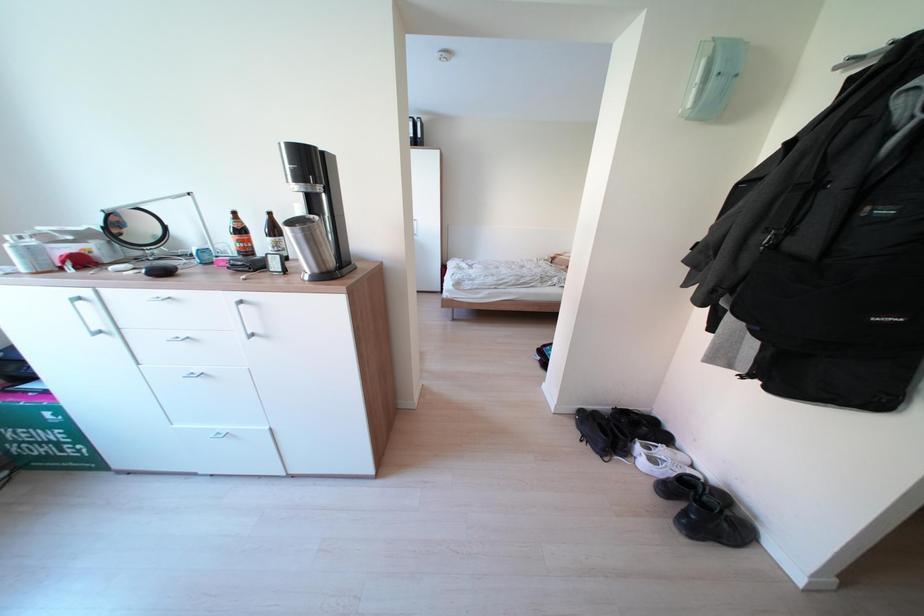
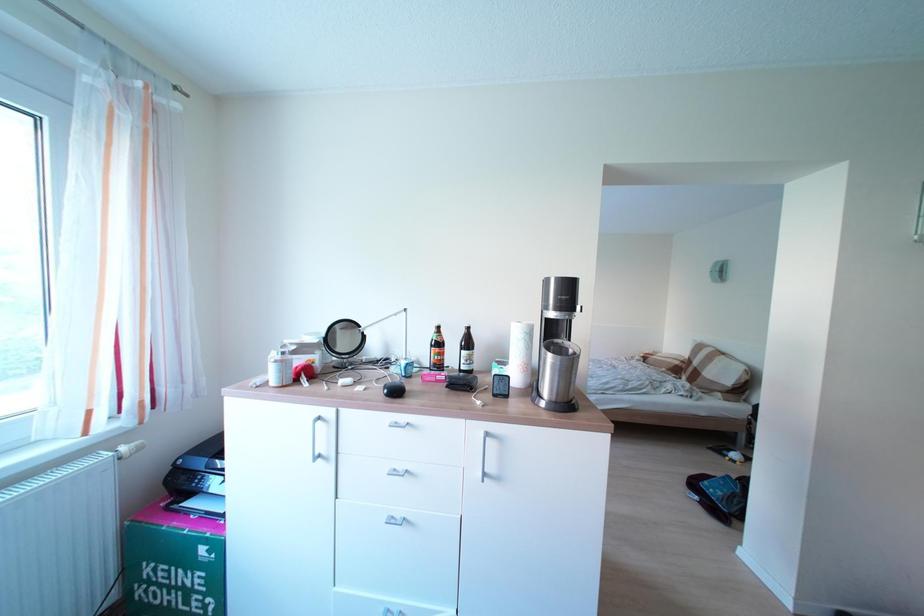
Question: The first image is from the beginning of the video and the second image is from the end. How did the camera likely rotate when shooting the video?

Choices:
 (A) Left
 (B) Right
 (C) Up
 (D) Down

Answer: (C)